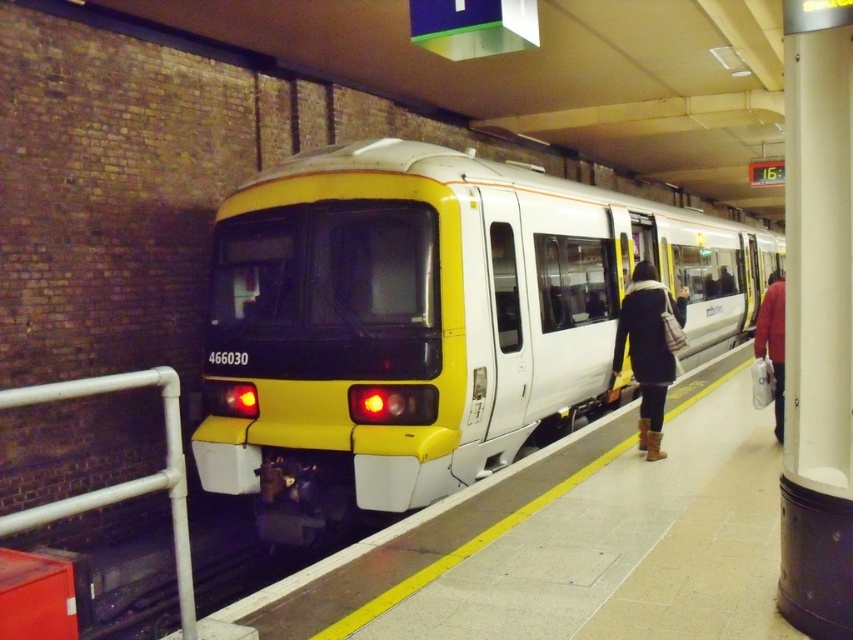
Between dark brown leather boots at lower right and red leather jacket at right, which one has less height?

dark brown leather boots at lower right is shorter.

Which of these two, dark brown leather boots at lower right or red leather jacket at right, stands taller?

red leather jacket at right is taller.

Is point (631, 282) more distant than point (775, 305)?

Yes.

The height and width of the screenshot is (640, 853). Find the location of `dark brown leather boots at lower right`. dark brown leather boots at lower right is located at coordinates (647, 349).

Does yellow matte train at center appear on the left side of red leather jacket at right?

Yes, yellow matte train at center is to the left of red leather jacket at right.

Between yellow matte train at center and red leather jacket at right, which one appears on the right side from the viewer's perspective?

red leather jacket at right

Is point (282, 248) more distant than point (776, 298)?

That is False.

I want to click on yellow matte train at center, so click(428, 321).

Looking at this image, is yellow matte train at center positioned in front of white glossy rail at left?

No, it is not.

Between yellow matte train at center and white glossy rail at left, which one appears on the left side from the viewer's perspective?

white glossy rail at left

Is point (476, 308) farther from camera compared to point (102, 506)?

Yes, it is behind point (102, 506).

Identify the location of yellow matte train at center. (428, 321).